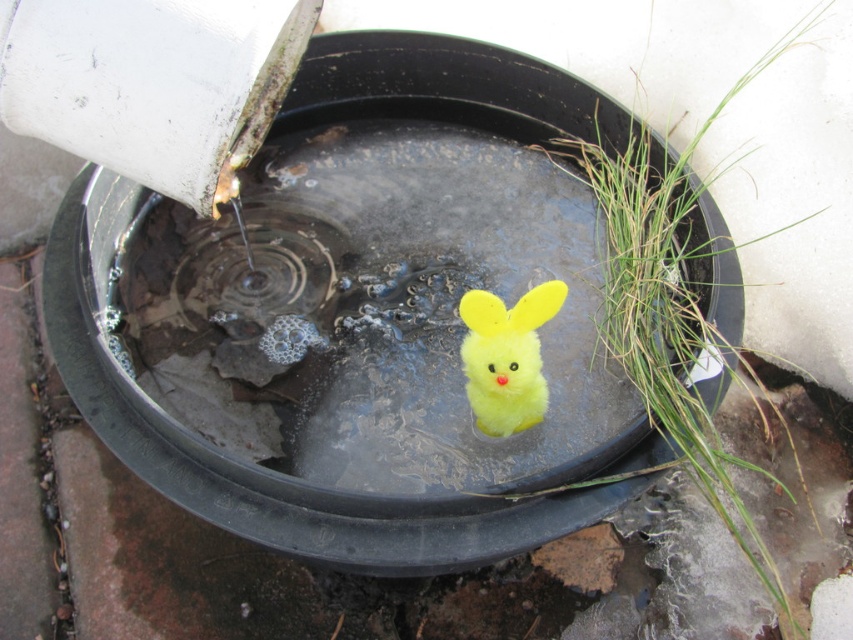
Question: Which object appears farthest from the camera in this image?

Choices:
 (A) fluffy yellow plush at center
 (B) yellow plush toy at center

Answer: (A)

Question: Can you confirm if yellow plush toy at center is wider than fluffy yellow plush at center?

Choices:
 (A) yes
 (B) no

Answer: (A)

Question: Among these points, which one is farthest from the camera?

Choices:
 (A) (158, 280)
 (B) (518, 317)

Answer: (A)

Question: Observing the image, what is the correct spatial positioning of yellow plush toy at center in reference to fluffy yellow plush at center?

Choices:
 (A) below
 (B) above

Answer: (B)

Question: Does yellow plush toy at center appear on the right side of fluffy yellow plush at center?

Choices:
 (A) yes
 (B) no

Answer: (B)